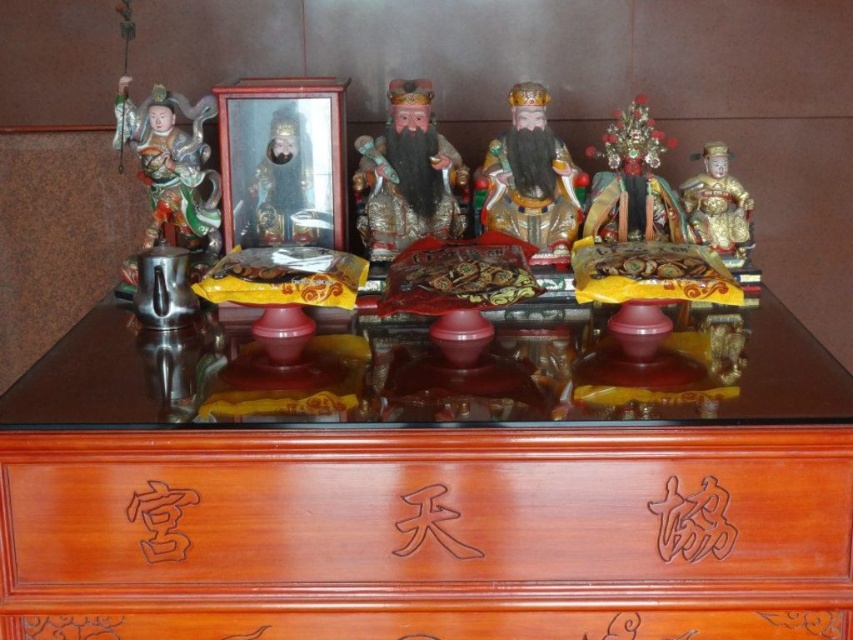
Does metallic frame at center have a lesser width compared to shiny metallic figure at left?

No.

Is point (248, 168) positioned in front of point (172, 129)?

Yes, it is in front of point (172, 129).

Locate an element on the screen. The width and height of the screenshot is (853, 640). metallic frame at center is located at coordinates (282, 161).

Is glossy gold statue at center to the right of gold lacquered statue at right from the viewer's perspective?

In fact, glossy gold statue at center is to the left of gold lacquered statue at right.

Identify the location of glossy gold statue at center. Image resolution: width=853 pixels, height=640 pixels. (531, 180).

You are a GUI agent. You are given a task and a screenshot of the screen. Output one action in this format:
    pyautogui.click(x=<x>, y=<y>)
    Task: Click on the glossy gold statue at center
    
    Given the screenshot: What is the action you would take?
    pyautogui.click(x=531, y=180)

Does wooden table at center appear under shiny gold ornament at center?

Yes, wooden table at center is below shiny gold ornament at center.

Can you confirm if wooden table at center is thinner than shiny gold ornament at center?

Incorrect, wooden table at center's width is not less than shiny gold ornament at center's.

Does point (602, 536) lie behind point (651, 132)?

That is False.

In order to click on wooden table at center in this screenshot , I will do `click(428, 481)`.